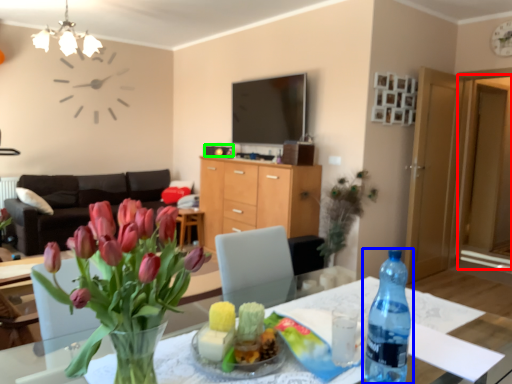
Question: Considering the real-world distances, which object is farthest from glass door (highlighted by a red box)? bottle (highlighted by a blue box) or corded phone (highlighted by a green box)?

Choices:
 (A) bottle
 (B) corded phone

Answer: (A)